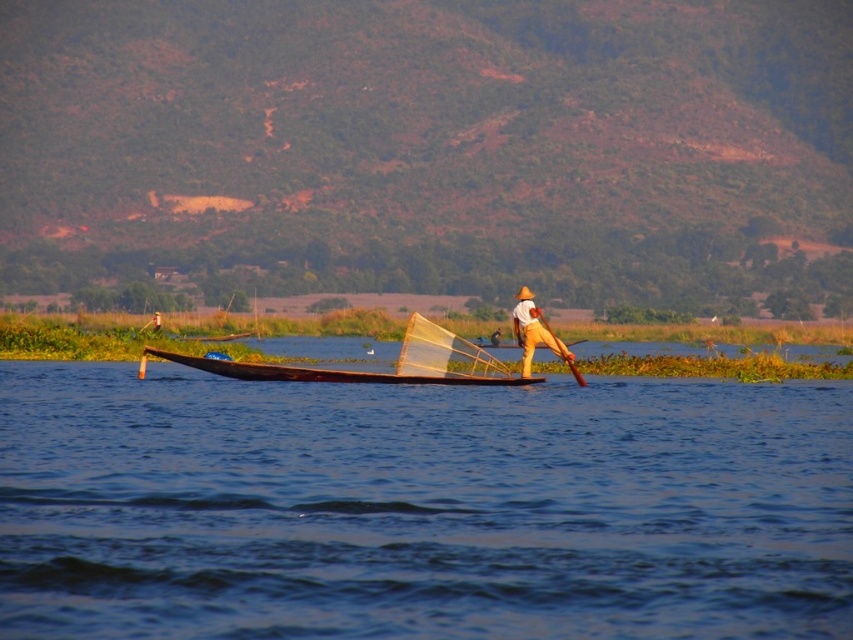
Question: Estimate the real-world distances between objects in this image. Which object is farther from the wooden canoe at center?

Choices:
 (A) wooden paddle at center
 (B) blue wooden boat at center
 (C) yellow fabric hat at center

Answer: (B)

Question: Does blue wooden boat at center lie behind wooden paddle at center?

Choices:
 (A) yes
 (B) no

Answer: (B)

Question: From the image, what is the correct spatial relationship of blue wooden boat at center in relation to wooden canoe at center?

Choices:
 (A) left
 (B) right

Answer: (B)

Question: Can you confirm if wooden canoe at center is smaller than yellow fabric hat at center?

Choices:
 (A) no
 (B) yes

Answer: (A)

Question: Which object appears closest to the camera in this image?

Choices:
 (A) yellow fabric hat at center
 (B) blue wooden boat at center

Answer: (B)

Question: Which object is positioned farthest from the blue wooden boat at center?

Choices:
 (A) wooden paddle at center
 (B) wooden canoe at center
 (C) yellow fabric hat at center

Answer: (C)